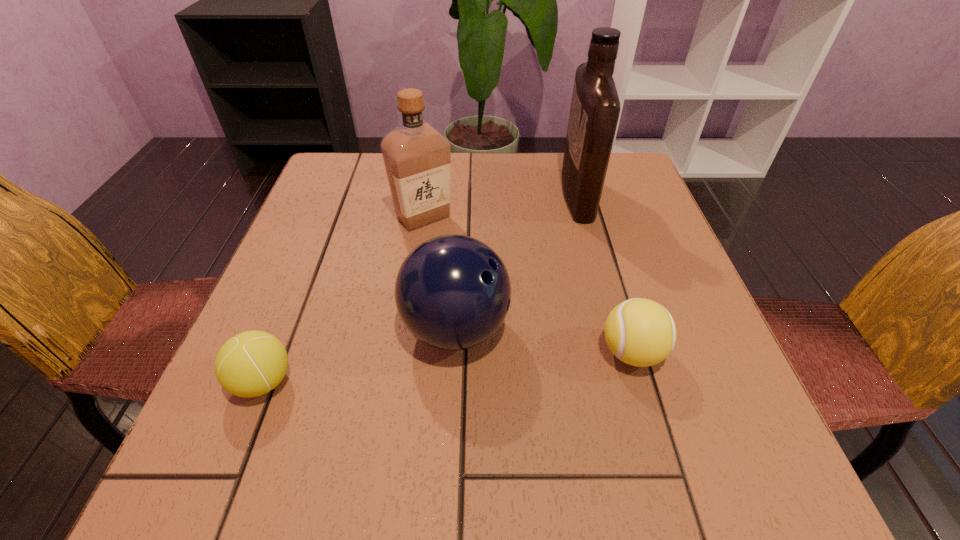
You are a GUI agent. You are given a task and a screenshot of the screen. Output one action in this format:
    pyautogui.click(x=<x>, y=<y>)
    Task: Click on the tallest object
    
    Given the screenshot: What is the action you would take?
    pyautogui.click(x=595, y=107)

At what (x,y) coordinates should I click in order to perform the action: click on the taller liquor. Please return your answer as a coordinate pair (x, y). This screenshot has height=540, width=960. Looking at the image, I should click on (595, 107).

The width and height of the screenshot is (960, 540). Find the location of `the fourth shortest object`. the fourth shortest object is located at coordinates (417, 158).

I want to click on the left liquor, so click(417, 158).

This screenshot has height=540, width=960. I want to click on the third shortest object, so click(x=452, y=292).

The height and width of the screenshot is (540, 960). Find the location of `the right tennis ball`. the right tennis ball is located at coordinates (640, 332).

This screenshot has width=960, height=540. In order to click on the leftmost object in this screenshot , I will do `click(252, 363)`.

The image size is (960, 540). Identify the location of free space located 0.190m on the label side of the tallest object. (485, 195).

At what (x,y) coordinates should I click in order to perform the action: click on free space located 0.110m on the label side of the tallest object. Please return your answer as a coordinate pair (x, y). This screenshot has height=540, width=960. Looking at the image, I should click on (517, 195).

At what (x,y) coordinates should I click in order to perform the action: click on free space located on the label side of the tallest object. Please return your answer as a coordinate pair (x, y). This screenshot has height=540, width=960. Looking at the image, I should click on click(x=420, y=195).